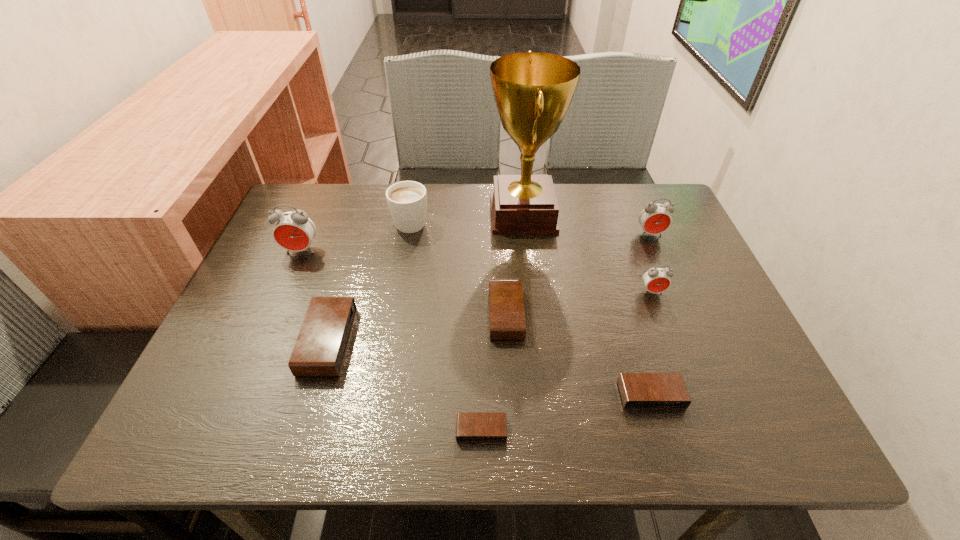
Image resolution: width=960 pixels, height=540 pixels. What are the coordinates of `free location that satisfies the following two spatial constraints: 1. on the plaque of the gold award; 2. on the front face of the nearest object` in the screenshot? It's located at (548, 430).

Find the location of a particular element. The width and height of the screenshot is (960, 540). blank area in the image that satisfies the following two spatial constraints: 1. on the plaque of the gold award; 2. on the front face of the shortest alarm clock is located at coordinates (548, 430).